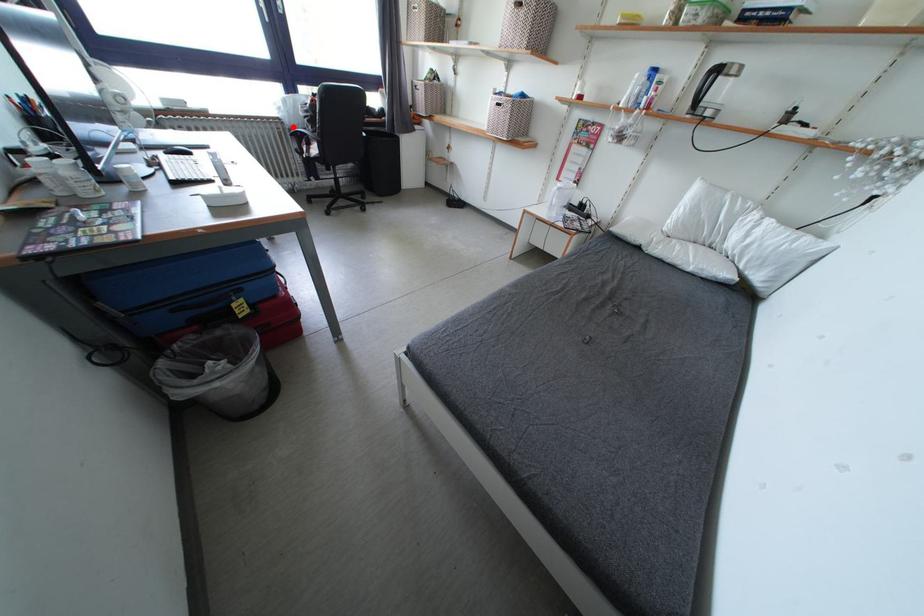
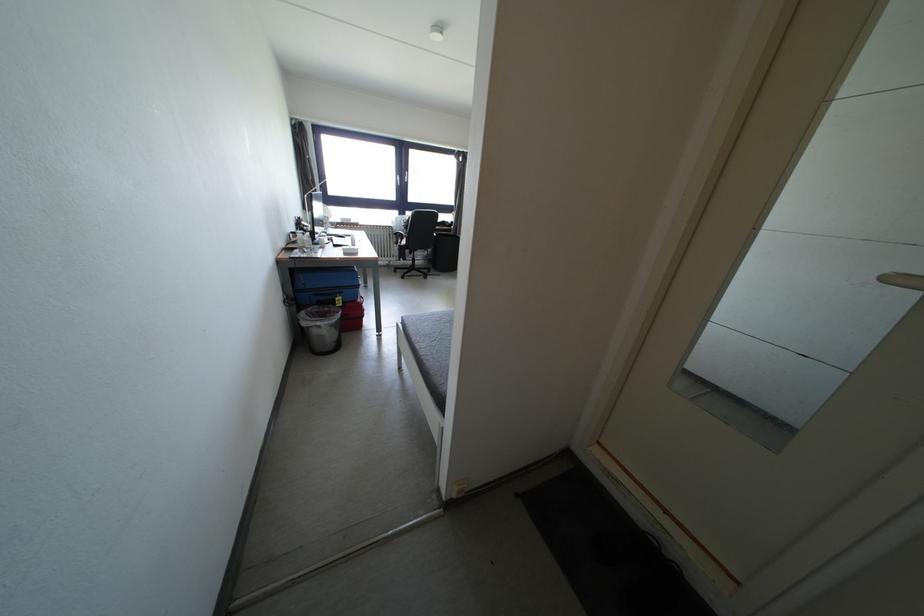
Question: I am providing you with two images of the same scene from different viewpoints. In image1, a red point is highlighted. Considering the same 3D point in image2, which of the following is correct?

Choices:
 (A) It is closer
 (B) It is farther

Answer: (A)